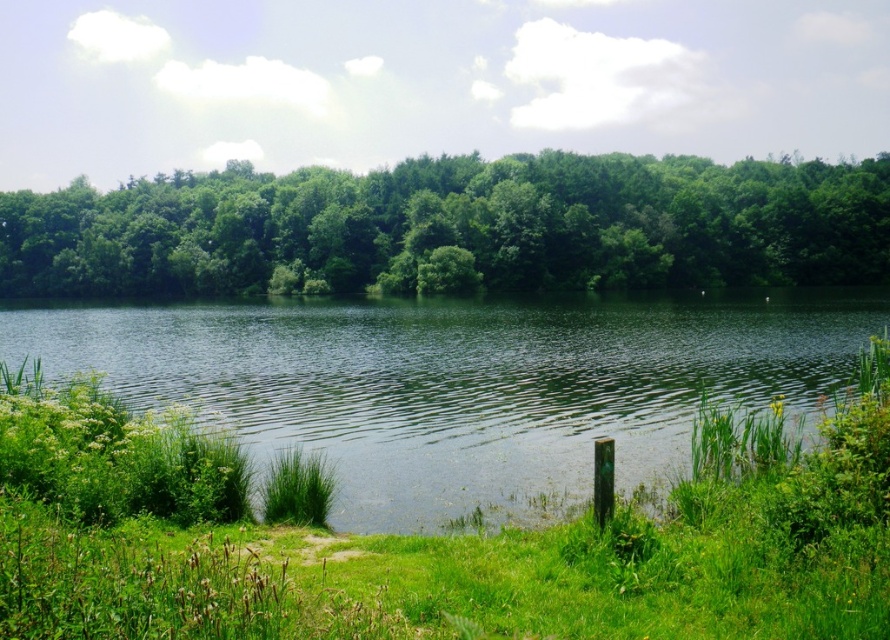
You are standing at the edge of the lake and notice two points in the scene. The first point is located at coordinates point (544, 317), and the second point is at point (880, 282). Which of these two points is closer to you?

Point (544, 317) is closer to the camera than point (880, 282), so the first point is closer to you.

You are standing at the edge of the water in the scene. There is a point marked at coordinates (x=462, y=385). What is located at that point?

The point at (x=462, y=385) is occupied by green liquid water at center.